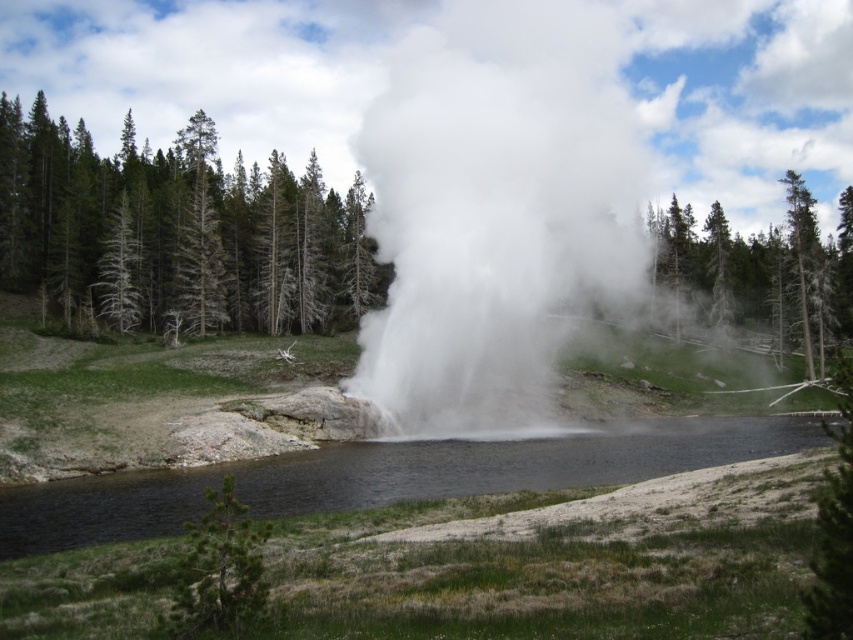
Question: Can you confirm if white vapor at center is wider than green textured tree at center?

Choices:
 (A) yes
 (B) no

Answer: (A)

Question: Can you confirm if clear water at center is positioned above green leafy tree at upper center?

Choices:
 (A) no
 (B) yes

Answer: (A)

Question: Is white vapor at center in front of green leafy tree at upper center?

Choices:
 (A) no
 (B) yes

Answer: (B)

Question: Based on their relative distances, which object is nearer to the white vapor at center?

Choices:
 (A) green leafy tree at upper center
 (B) green rough bark tree at lower left
 (C) green textured tree at center
 (D) clear water at center

Answer: (A)

Question: Which point is closer to the camera?

Choices:
 (A) white vapor at center
 (B) green leafy tree at upper center

Answer: (A)

Question: Which object appears farthest from the camera in this image?

Choices:
 (A) green leafy tree at upper center
 (B) green rough bark tree at lower left

Answer: (A)